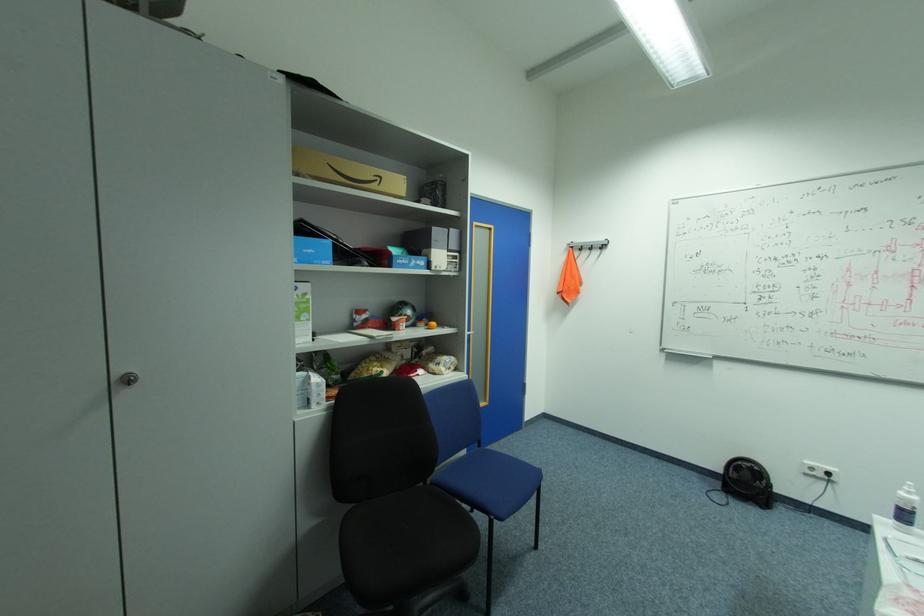
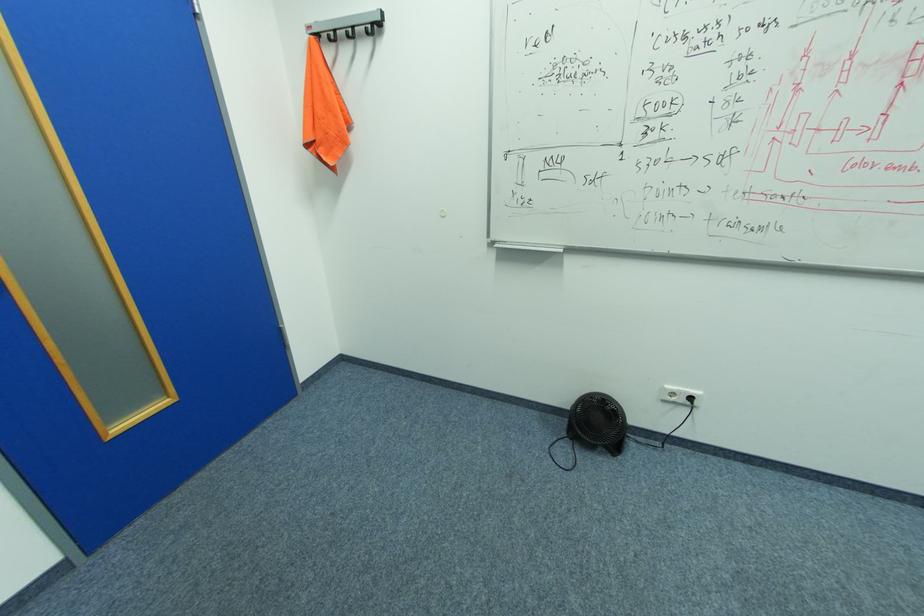
Where in the second image is the point corresponding to (x=724, y=484) from the first image?

(568, 423)